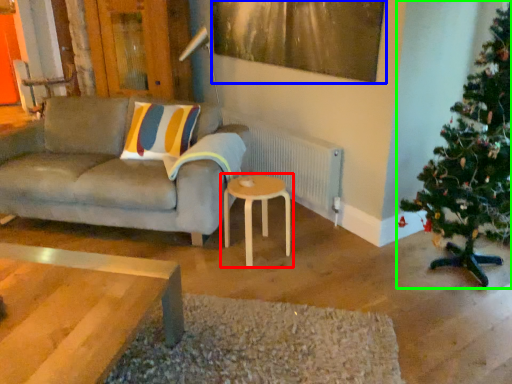
Question: Considering the real-world distances, which object is closest to table (highlighted by a red box)? picture frame (highlighted by a blue box) or christmas tree (highlighted by a green box).

Choices:
 (A) picture frame
 (B) christmas tree

Answer: (B)